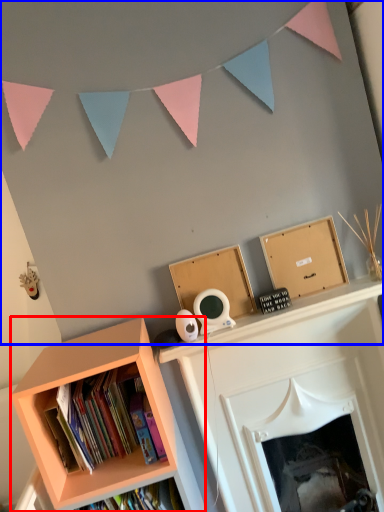
Question: Which of the following is the closest to the observer, bookcase (highlighted by a red box) or backdrop (highlighted by a blue box)?

Choices:
 (A) bookcase
 (B) backdrop

Answer: (A)